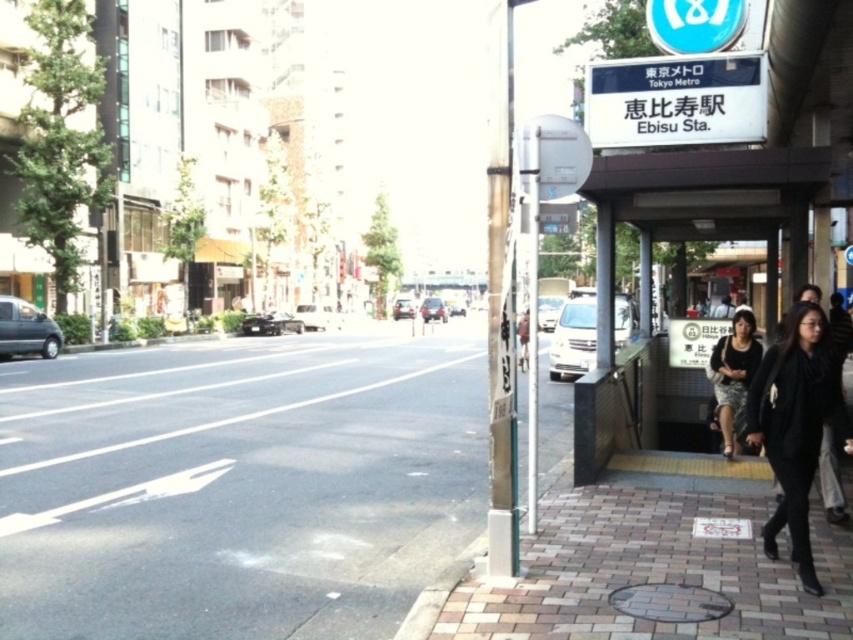
You are a photographer standing at the Tokyo Metro station entrance. You see a person wearing a black wool coat at lower right and a black textured skirt at lower right. Which clothing item is wider?

The black wool coat at lower right is wider than the black textured skirt at lower right according to the description.

You are a delivery person carrying a package and need to step onto the gray concrete pavement at lower left. The black textured skirt at lower right is blocking your path. Can you step over it easily?

The gray concrete pavement at lower left has a lesser height compared to black textured skirt at lower right, so stepping over it might be difficult due to the height difference.

You are a tourist in Tokyo and see the Tokyo Metro station entrance on the right side of the street. You need to walk from the gray concrete pavement at lower left to the black wool coat at lower right. Which direction should you move to reach the coat?

You should move to the right to reach the black wool coat at lower right since the gray concrete pavement at lower left is to the left of it.